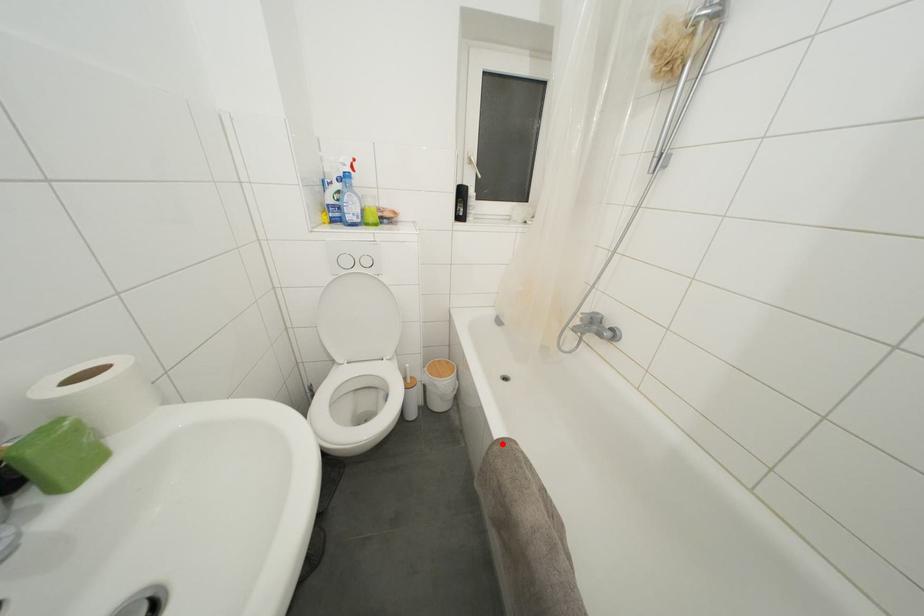
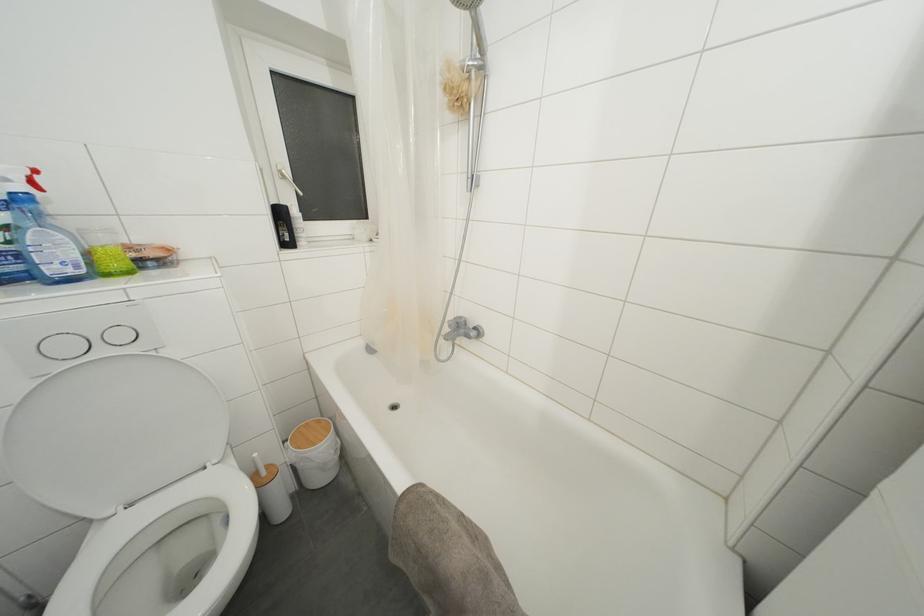
The point at the highlighted location is marked in the first image. Where is the corresponding point in the second image?

(407, 498)